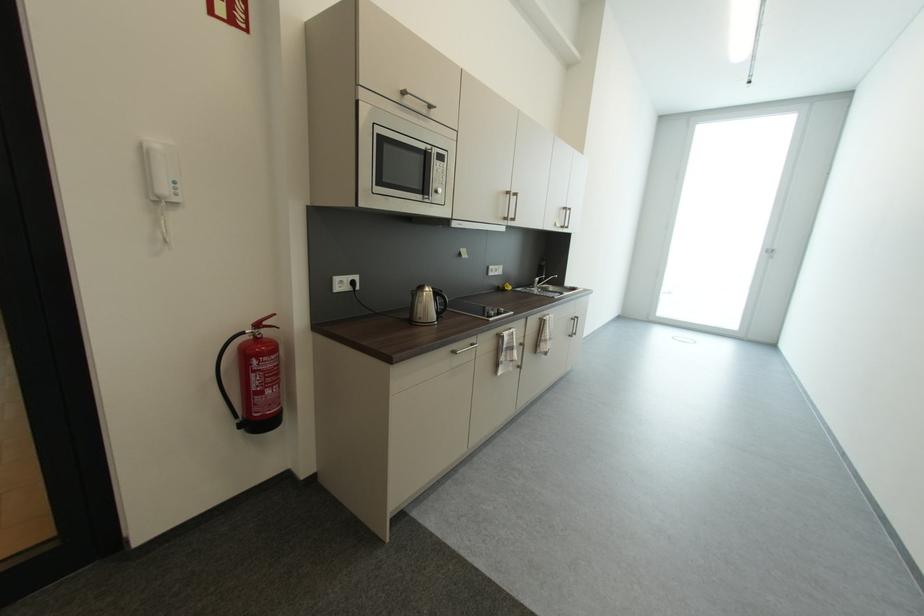
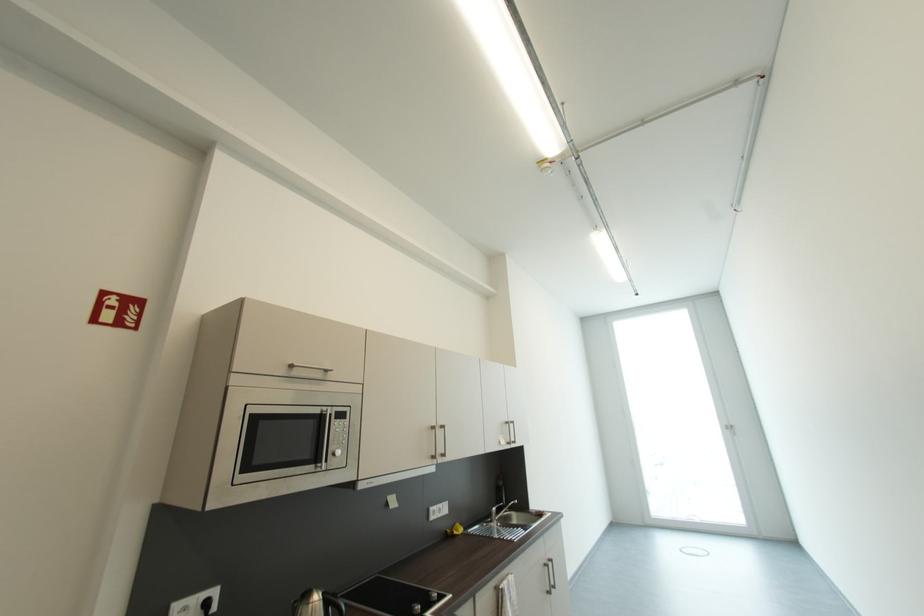
Locate, in the second image, the point that corresponds to point 432,294 in the first image.

(317, 607)